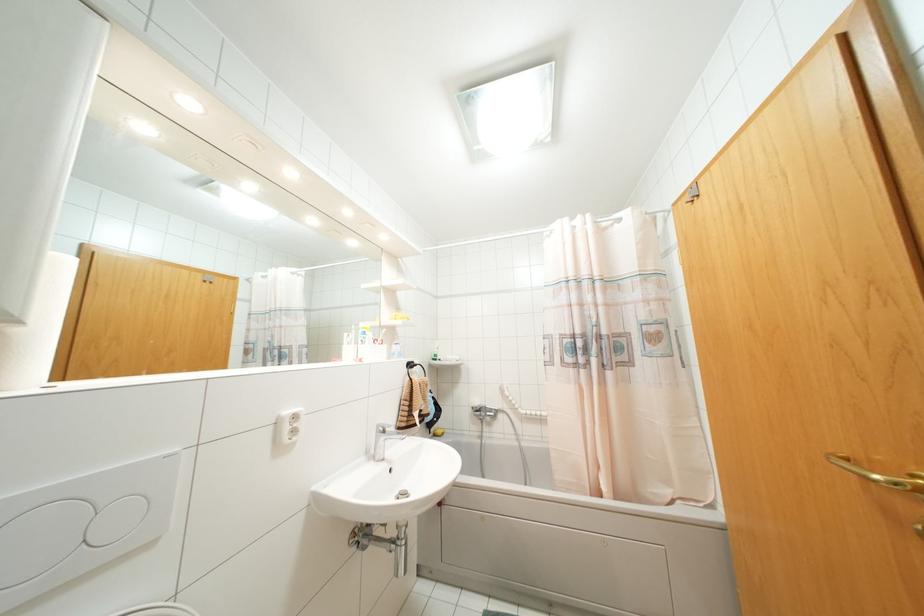
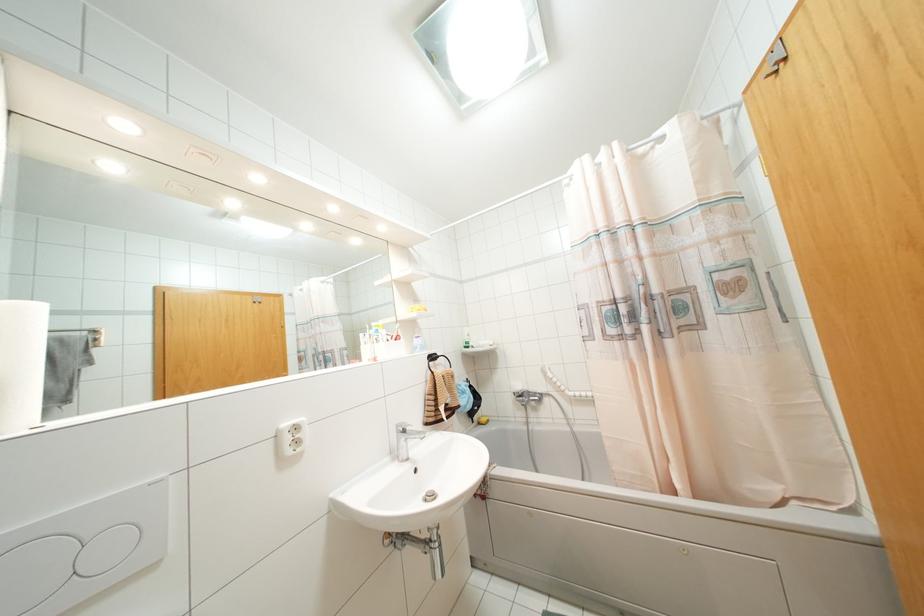
Where in the second image is the point corresponding to point (294, 431) from the first image?

(297, 442)